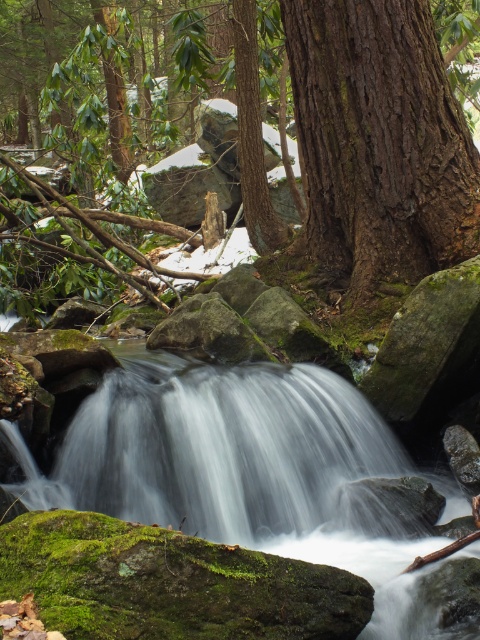
Does brown rough tree at center have a lesser height compared to white smooth water at center?

Incorrect, brown rough tree at center's height does not fall short of white smooth water at center's.

Which is in front, point (108, 116) or point (314, 460)?

Point (314, 460) is more forward.

Is point (394, 209) farther from camera compared to point (208, 449)?

Yes.

This screenshot has height=640, width=480. I want to click on brown rough tree at center, so click(377, 129).

Does brown rough tree at center have a greater height compared to dark brown textured bark at center?

Yes.

The height and width of the screenshot is (640, 480). I want to click on brown rough tree at center, so click(x=377, y=129).

This screenshot has width=480, height=640. I want to click on white smooth water at center, so click(x=245, y=468).

Between white smooth water at center and dark brown textured bark at center, which one is positioned lower?

white smooth water at center is lower down.

Does point (309, 500) come behind point (297, 104)?

No, it is in front of (297, 104).

You are a GUI agent. You are given a task and a screenshot of the screen. Output one action in this format:
    pyautogui.click(x=<x>, y=<y>)
    Task: Click on the white smooth water at center
    
    Given the screenshot: What is the action you would take?
    pyautogui.click(x=245, y=468)